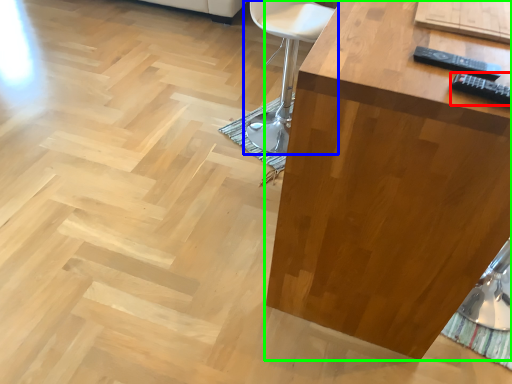
Question: Estimate the real-world distances between objects in this image. Which object is farther from remote (highlighted by a red box), chair (highlighted by a blue box) or table (highlighted by a green box)?

Choices:
 (A) chair
 (B) table

Answer: (A)